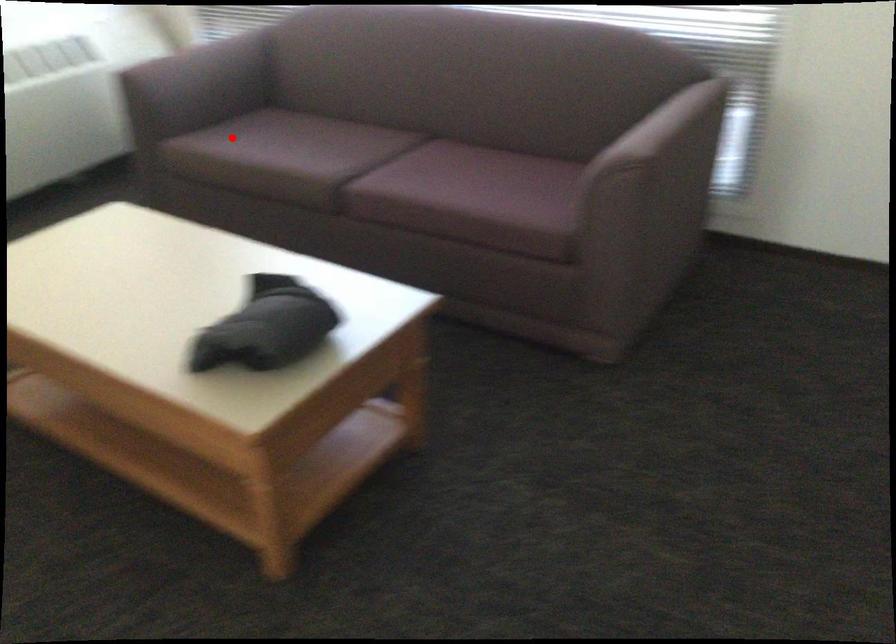
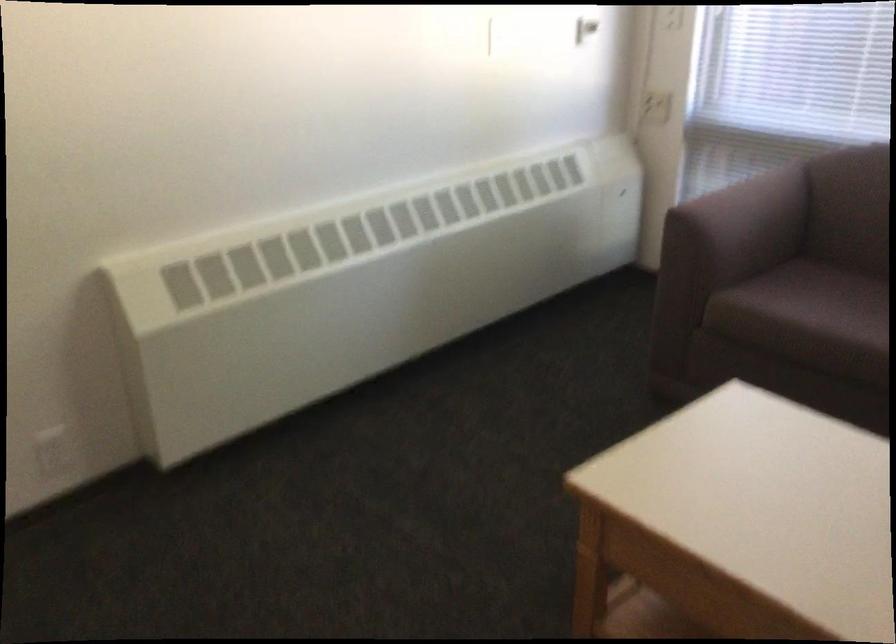
Question: I am providing you with two images of the same scene from different viewpoints. Given a red point in image1, look at the same physical point in image2. Is it:

Choices:
 (A) Closer to the viewpoint
 (B) Farther from the viewpoint

Answer: (A)